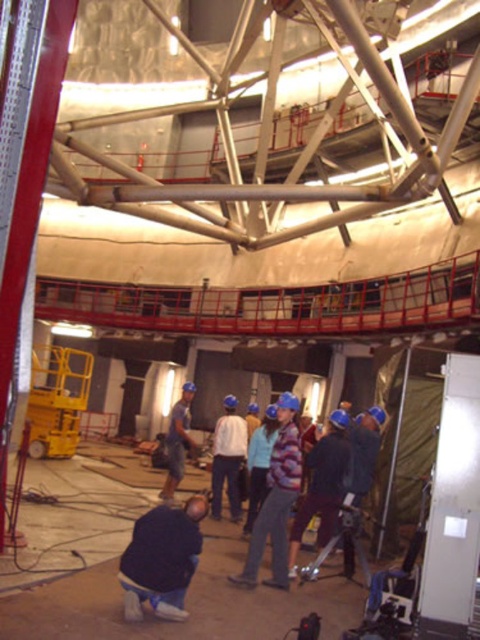
Who is shorter, white matte shirt at center or blue hard hat at center?

Standing shorter between the two is white matte shirt at center.

Which is below, white matte shirt at center or blue hard hat at center?

blue hard hat at center is lower down.

Where is `white matte shirt at center`? white matte shirt at center is located at coordinates (228, 458).

Looking at this image, is dark blue jeans at lower center below white matte shirt at center?

No, dark blue jeans at lower center is not below white matte shirt at center.

Is point (156, 592) closer to viewer compared to point (230, 452)?

Yes, it is in front of point (230, 452).

You are a GUI agent. You are given a task and a screenshot of the screen. Output one action in this format:
    pyautogui.click(x=<x>, y=<y>)
    Task: Click on the dark blue jeans at lower center
    
    Given the screenshot: What is the action you would take?
    pyautogui.click(x=162, y=560)

This screenshot has width=480, height=640. Find the location of `dark blue jeans at lower center`. dark blue jeans at lower center is located at coordinates (162, 560).

Who is taller, dark blue jeans at lower center or blue hard hat at center?

blue hard hat at center

Does dark blue jeans at lower center appear under blue hard hat at center?

Incorrect, dark blue jeans at lower center is not positioned below blue hard hat at center.

Who is more distant from viewer, (153,596) or (171,435)?

Positioned behind is point (171,435).

In order to click on dark blue jeans at lower center in this screenshot , I will do `click(162, 560)`.